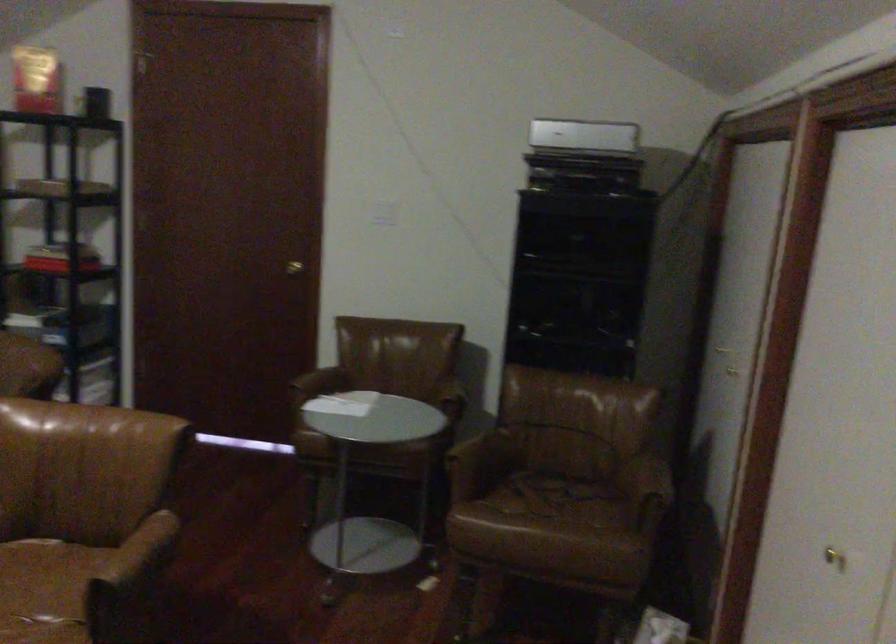
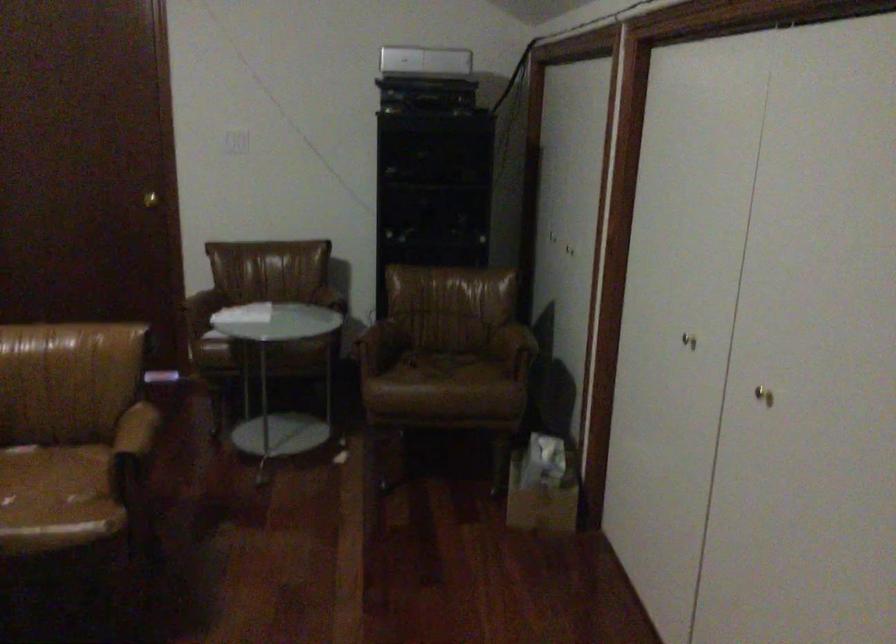
Question: Based on the continuous images, in which direction is the camera rotating? Reply with the corresponding letter.

Choices:
 (A) Left
 (B) Right
 (C) Up
 (D) Down

Answer: (B)